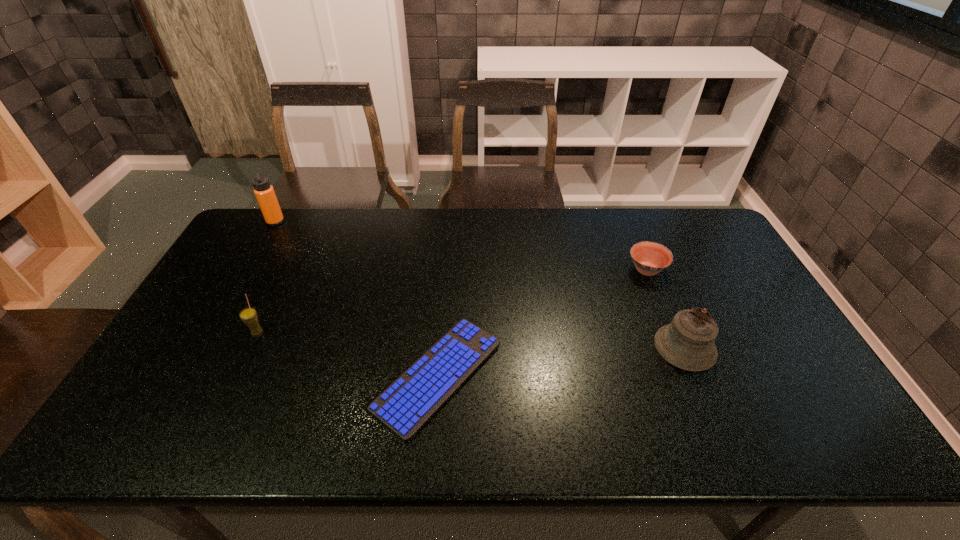
Locate an element on the screen. vacant space at the left edge of the desktop is located at coordinates (239, 282).

You are a GUI agent. You are given a task and a screenshot of the screen. Output one action in this format:
    pyautogui.click(x=<x>, y=<y>)
    Task: Click on the vacant region at the right edge of the desktop
    
    Given the screenshot: What is the action you would take?
    pyautogui.click(x=756, y=334)

Where is `vacant space at the far left corner of the desktop`? The image size is (960, 540). vacant space at the far left corner of the desktop is located at coordinates (249, 232).

Where is `vacant space at the near right corner of the desktop`? The image size is (960, 540). vacant space at the near right corner of the desktop is located at coordinates (771, 421).

Image resolution: width=960 pixels, height=540 pixels. Find the location of `vacant area that lies between the straw for drinking and the fourth nearest object`. vacant area that lies between the straw for drinking and the fourth nearest object is located at coordinates (452, 301).

Where is `free area in between the fourth tallest object and the leftmost object`? Image resolution: width=960 pixels, height=540 pixels. free area in between the fourth tallest object and the leftmost object is located at coordinates (461, 246).

This screenshot has width=960, height=540. Identify the location of blank region between the tallest object and the third shortest object. (267, 277).

Find the location of a particular element. The image size is (960, 540). free spot between the tallest object and the bell is located at coordinates (480, 285).

Find the location of `free space that is in between the shortest object and the bell`. free space that is in between the shortest object and the bell is located at coordinates (562, 361).

This screenshot has height=540, width=960. I want to click on unoccupied area between the bowl and the third object from left to right, so click(542, 323).